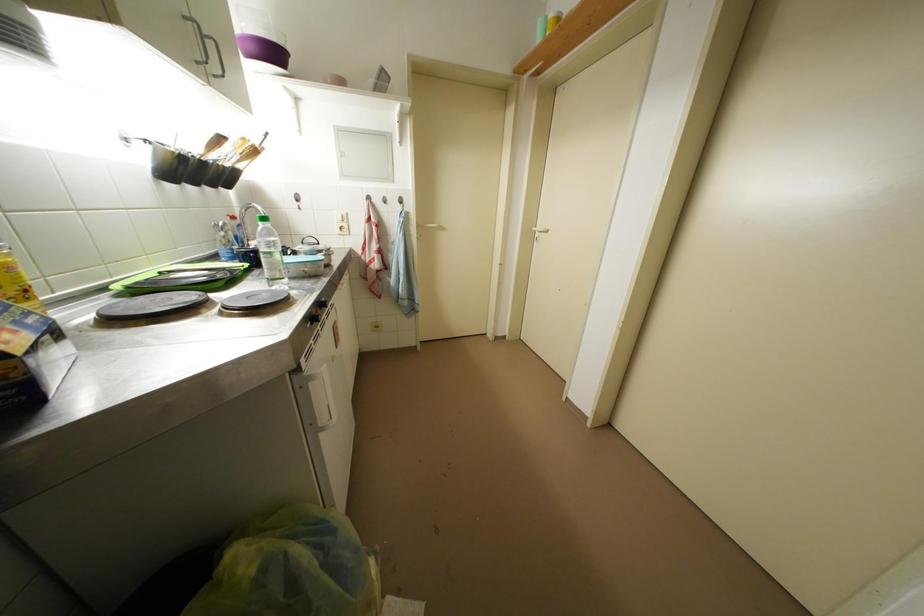
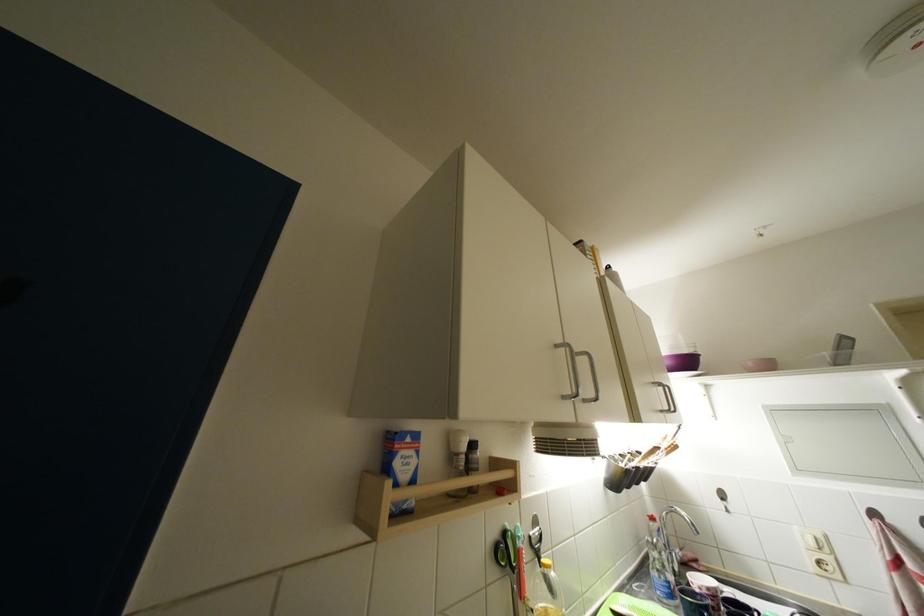
In the second image, find the point that corresponds to the point at 259,53 in the first image.

(675, 367)